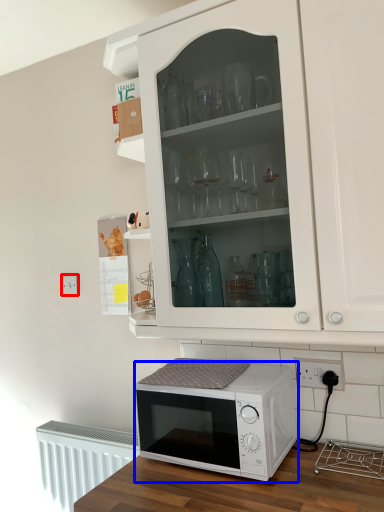
Question: Which of the following is the closest to the observer, electric outlet (highlighted by a red box) or microwave oven (highlighted by a blue box)?

Choices:
 (A) electric outlet
 (B) microwave oven

Answer: (B)